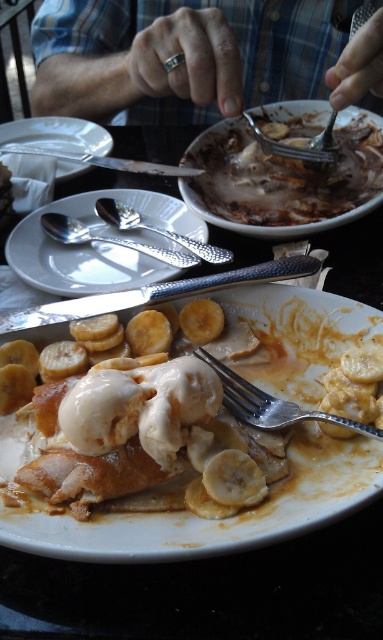
You are a guest at a dinner party and notice the silver metallic ring at upper center and the white porcelain plate at center on the table. Which object is positioned higher relative to the other?

The silver metallic ring at upper center is located above the white porcelain plate at center, so it is positioned higher.

You are a photographer adjusting your camera settings to focus on the silver metallic ring at upper center. According to the scene description, where exactly is the silver metallic ring positioned on the table?

The silver metallic ring at upper center is located at point coordinates of 0.089 on the x axis and 0.517 on the y axis.